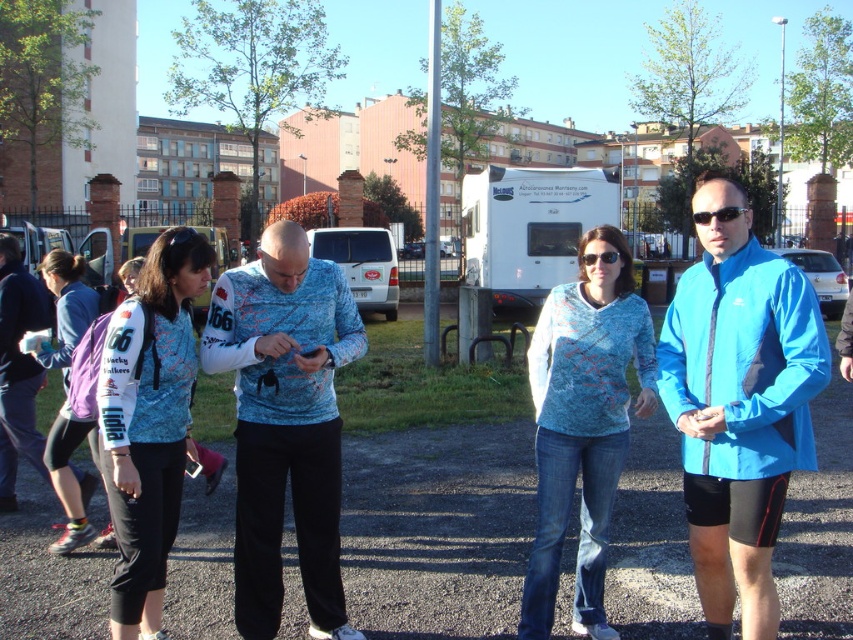
Question: Among these objects, which one is nearest to the camera?

Choices:
 (A) purple fabric backpack at left
 (B) matte blue vest at center

Answer: (B)

Question: In this image, where is matte blue vest at center located relative to purple fabric backpack at left?

Choices:
 (A) right
 (B) left

Answer: (A)

Question: Which point is closer to the camera?

Choices:
 (A) (554, 342)
 (B) (161, 237)
 (C) (56, 300)

Answer: (B)

Question: Considering the relative positions of textured blue sweater at center and matte blue vest at center in the image provided, where is textured blue sweater at center located with respect to matte blue vest at center?

Choices:
 (A) above
 (B) below

Answer: (A)

Question: Which of the following is the farthest from the observer?

Choices:
 (A) matte blue vest at center
 (B) textured blue sweater at center

Answer: (B)

Question: Does textured blue sweater at center have a smaller size compared to purple fabric backpack at left?

Choices:
 (A) no
 (B) yes

Answer: (B)